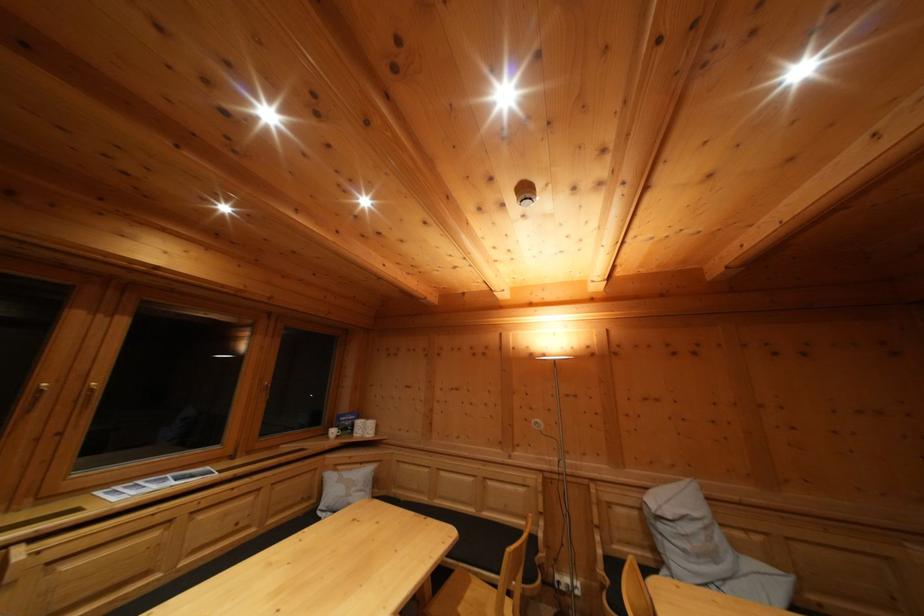
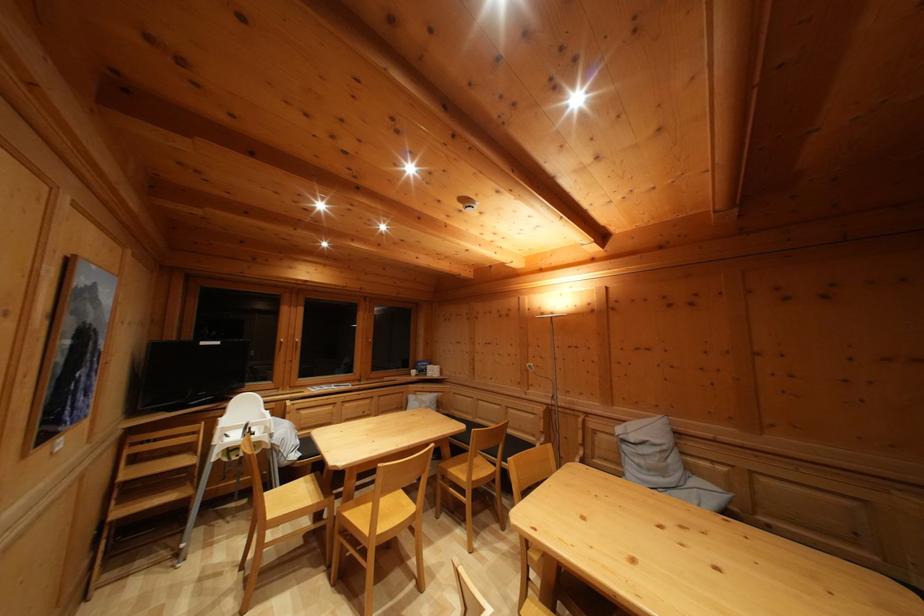
Find the pixel in the second image that matches the point at 339,439 in the first image.

(419, 379)